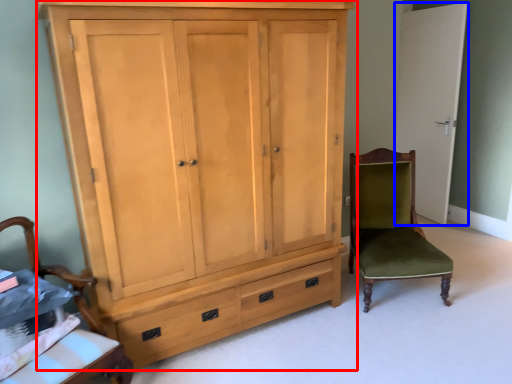
Question: Which object is further to the camera taking this photo, cupboard (highlighted by a red box) or door (highlighted by a blue box)?

Choices:
 (A) cupboard
 (B) door

Answer: (B)